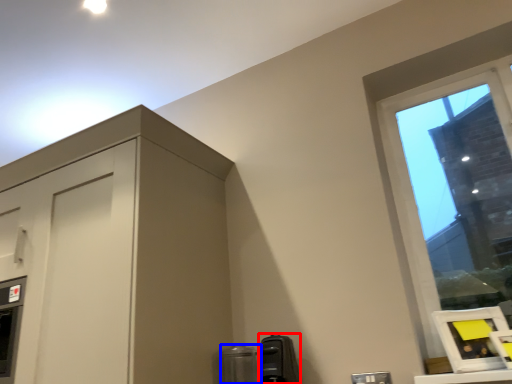
Question: Among these objects, which one is nearest to the camera, appliance (highlighted by a red box) or appliance (highlighted by a blue box)?

Choices:
 (A) appliance
 (B) appliance

Answer: (A)